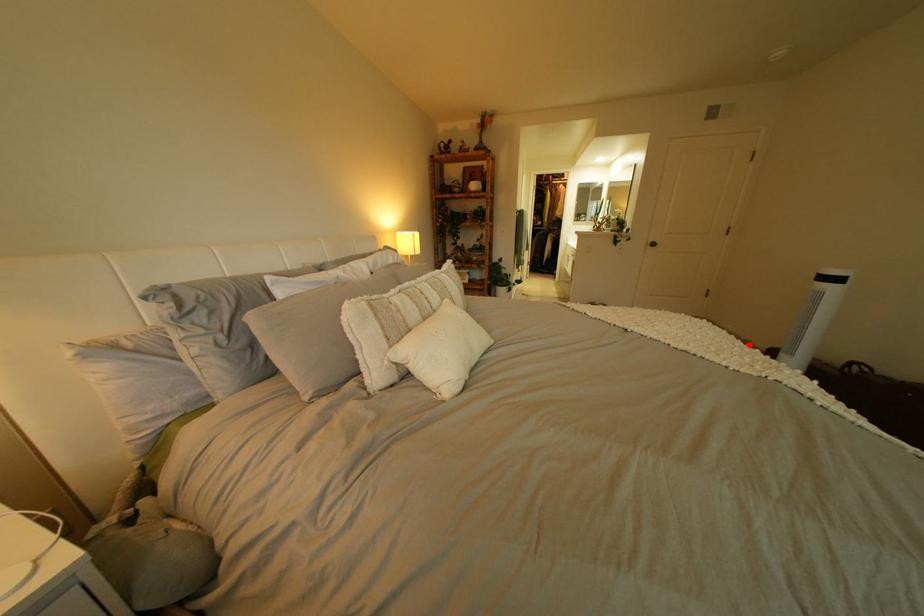
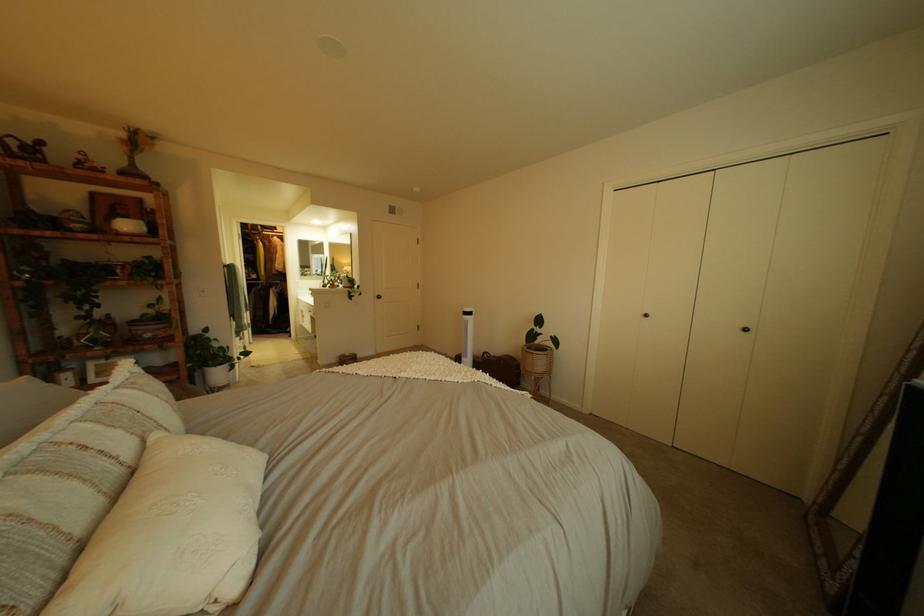
Question: I am providing you with two images of the same scene from different viewpoints. A red point is shown in image1. For the corresponding object point in image2, is it positioned nearer or farther from the camera?

Choices:
 (A) Nearer
 (B) Farther

Answer: (A)